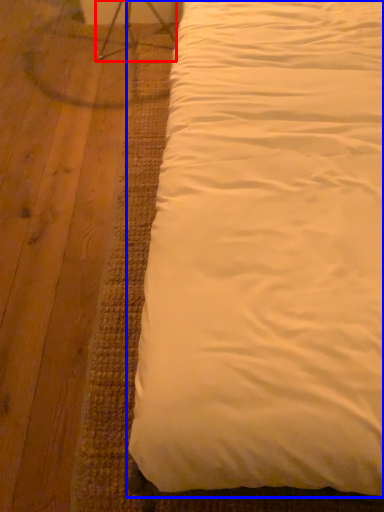
Question: Which point is further to the camera, swivel chair (highlighted by a red box) or bed (highlighted by a blue box)?

Choices:
 (A) swivel chair
 (B) bed

Answer: (A)